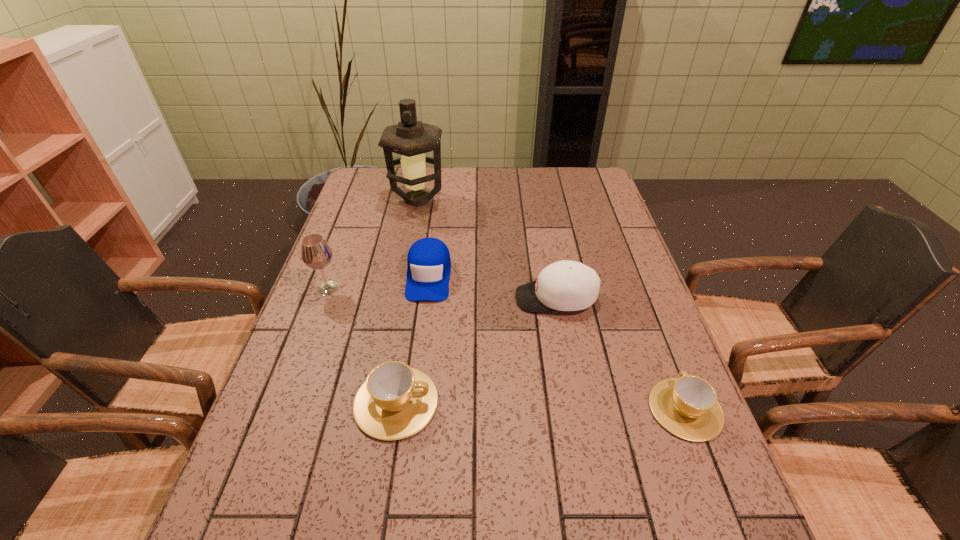
At what (x,y) coordinates should I click in order to perform the action: click on vacant area situated 0.310m with the handle on the side of the taller cup. Please return your answer as a coordinate pair (x, y). Looking at the image, I should click on 583,403.

You are a GUI agent. You are given a task and a screenshot of the screen. Output one action in this format:
    pyautogui.click(x=<x>, y=<y>)
    Task: Click on the vacant space located 0.170m with the handle on the side of the rightmost object
    The height and width of the screenshot is (540, 960).
    Given the screenshot: What is the action you would take?
    pyautogui.click(x=652, y=323)

You are a GUI agent. You are given a task and a screenshot of the screen. Output one action in this format:
    pyautogui.click(x=<x>, y=<y>)
    Task: Click on the free space located 0.080m with the handle on the side of the rightmost object
    
    Given the screenshot: What is the action you would take?
    pyautogui.click(x=662, y=352)

Identify the location of free space located with the handle on the side of the rightmost object. (637, 285).

Find the location of a particular element. The width and height of the screenshot is (960, 540). free space located on the front of the farthest object is located at coordinates (400, 289).

The image size is (960, 540). Identify the location of vacant space located 0.150m on the back of the leftmost object. (344, 246).

Find the location of a particular element. vacant area situated on the front-facing side of the shorter baseball cap is located at coordinates (423, 317).

At what (x,y) coordinates should I click in order to perform the action: click on free space located on the front-facing side of the fourth shortest object. Please return your answer as a coordinate pair (x, y). The image size is (960, 540). Looking at the image, I should click on (486, 298).

Find the location of a particular element. The width and height of the screenshot is (960, 540). free space located on the front-facing side of the fourth shortest object is located at coordinates (489, 298).

Image resolution: width=960 pixels, height=540 pixels. I want to click on vacant space located on the front-facing side of the fourth shortest object, so click(x=444, y=298).